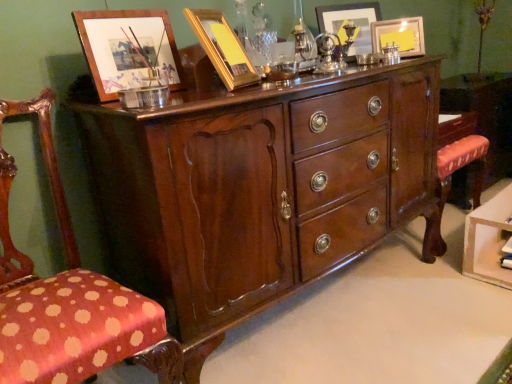
Question: Which direction should I rotate to look at gold metallic picture frame at upper center, which is the second picture frame in front-to-back order, — up or down?

Choices:
 (A) up
 (B) down

Answer: (A)

Question: Considering the relative sizes of shiny brown wood chest of drawers at center and polka dot fabric chair at left in the image provided, is shiny brown wood chest of drawers at center smaller than polka dot fabric chair at left?

Choices:
 (A) no
 (B) yes

Answer: (A)

Question: Would you say shiny brown wood chest of drawers at center is outside polka dot fabric chair at left?

Choices:
 (A) yes
 (B) no

Answer: (A)

Question: Considering the relative positions of shiny brown wood chest of drawers at center and polka dot fabric chair at left in the image provided, is shiny brown wood chest of drawers at center to the right of polka dot fabric chair at left from the viewer's perspective?

Choices:
 (A) yes
 (B) no

Answer: (A)

Question: From the image's perspective, would you say shiny brown wood chest of drawers at center is positioned over polka dot fabric chair at left?

Choices:
 (A) yes
 (B) no

Answer: (A)

Question: Is shiny brown wood chest of drawers at center shorter than polka dot fabric chair at left?

Choices:
 (A) yes
 (B) no

Answer: (A)

Question: Is shiny brown wood chest of drawers at center facing away from polka dot fabric chair at left?

Choices:
 (A) no
 (B) yes

Answer: (A)

Question: Is matte gold picture frame at upper right, which appears as the first picture frame when viewed from the right, at the left side of wooden picture frame at upper left, arranged as the 4th picture frame when viewed from the back?

Choices:
 (A) no
 (B) yes

Answer: (A)

Question: From a real-world perspective, does matte gold picture frame at upper right, which is the second picture frame from back to front, sit lower than wooden picture frame at upper left, which is counted as the first picture frame, starting from the front?

Choices:
 (A) yes
 (B) no

Answer: (A)

Question: From a real-world perspective, is matte gold picture frame at upper right, which is the second picture frame from back to front, physically above wooden picture frame at upper left, which is counted as the first picture frame, starting from the front?

Choices:
 (A) no
 (B) yes

Answer: (A)

Question: Is the position of matte gold picture frame at upper right, which appears as the first picture frame when viewed from the right, more distant than that of wooden picture frame at upper left, acting as the 4th picture frame starting from the right?

Choices:
 (A) no
 (B) yes

Answer: (B)

Question: From the image's perspective, is matte gold picture frame at upper right, placed as the 4th picture frame when sorted from left to right, under wooden picture frame at upper left, the 1th picture frame from the left?

Choices:
 (A) no
 (B) yes

Answer: (A)

Question: Does matte gold picture frame at upper right, placed as the 4th picture frame when sorted from left to right, appear on the right side of wooden picture frame at upper left, acting as the 4th picture frame starting from the right?

Choices:
 (A) yes
 (B) no

Answer: (A)

Question: From a real-world perspective, is shiny brown wood chest of drawers at center located higher than gold metallic picture frame at upper center, arranged as the 2th picture frame when viewed from the left?

Choices:
 (A) yes
 (B) no

Answer: (B)